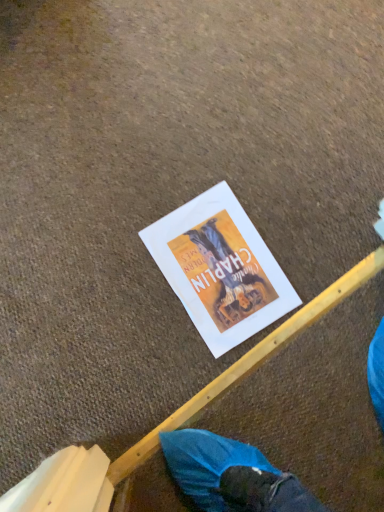
Locate an element on the screen. The width and height of the screenshot is (384, 512). vacant area that is in front of matte paper flyer at center is located at coordinates (142, 350).